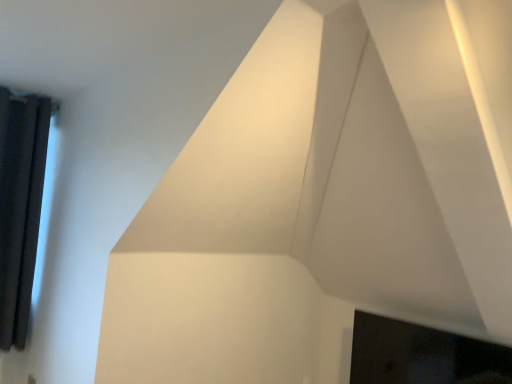
Question: Looking at their shapes, would you say black glossy fireplace at lower right is wider or thinner than black curtain at left?

Choices:
 (A) wide
 (B) thin

Answer: (A)

Question: Is black glossy fireplace at lower right in front of or behind black curtain at left in the image?

Choices:
 (A) behind
 (B) front

Answer: (B)

Question: From their relative heights in the image, would you say black glossy fireplace at lower right is taller or shorter than black curtain at left?

Choices:
 (A) tall
 (B) short

Answer: (B)

Question: From the image's perspective, relative to black glossy fireplace at lower right, is black curtain at left above or below?

Choices:
 (A) below
 (B) above

Answer: (B)

Question: Considering the relative positions of black curtain at left and black glossy fireplace at lower right in the image provided, is black curtain at left to the left or to the right of black glossy fireplace at lower right?

Choices:
 (A) left
 (B) right

Answer: (A)

Question: From a real-world perspective, is black curtain at left physically located above or below black glossy fireplace at lower right?

Choices:
 (A) below
 (B) above

Answer: (B)

Question: Considering the positions of black curtain at left and black glossy fireplace at lower right in the image, is black curtain at left bigger or smaller than black glossy fireplace at lower right?

Choices:
 (A) big
 (B) small

Answer: (B)